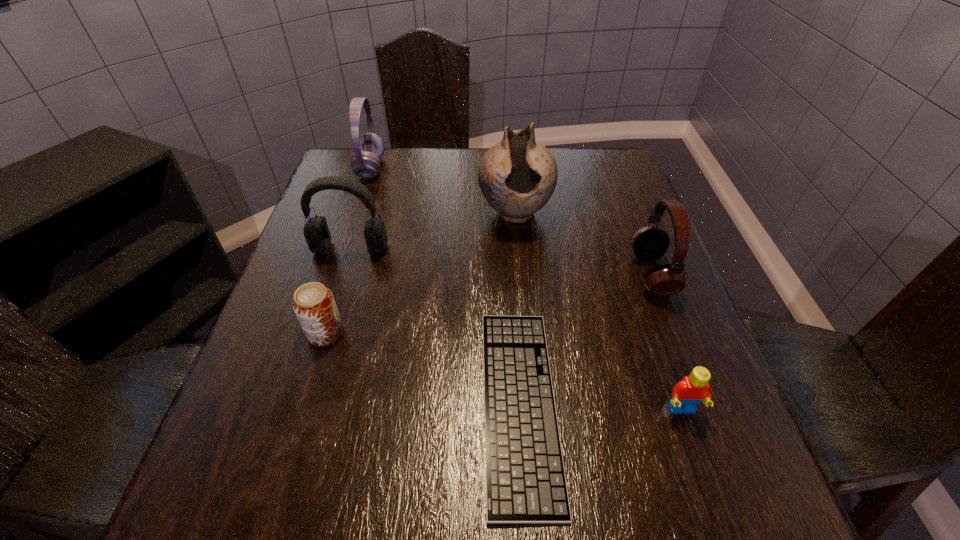
Locate an element on the screen. This screenshot has width=960, height=540. vacant space located 0.070m on the ear pads of the rightmost headset is located at coordinates (602, 274).

Where is `vacant point located on the back of the beer can`? vacant point located on the back of the beer can is located at coordinates (336, 300).

The image size is (960, 540). What are the coordinates of `free space located 0.150m on the face of the Lego` in the screenshot? It's located at (718, 519).

The width and height of the screenshot is (960, 540). In order to click on vacant space located 0.130m on the back of the computer keyboard in this screenshot , I will do `click(511, 273)`.

Identify the location of pottery positioned at the far edge. (517, 176).

At what (x,y) coordinates should I click in order to perform the action: click on headset at the far edge. Please return your answer as a coordinate pair (x, y). The image size is (960, 540). Looking at the image, I should click on (369, 148).

The image size is (960, 540). Find the location of `object located at the near edge`. object located at the near edge is located at coordinates (525, 478).

You are a GUI agent. You are given a task and a screenshot of the screen. Output one action in this format:
    pyautogui.click(x=<x>, y=<y>)
    Task: Click on the beer can that is at the left edge
    
    Given the screenshot: What is the action you would take?
    pyautogui.click(x=314, y=305)

The height and width of the screenshot is (540, 960). I want to click on headset located at the right edge, so click(649, 243).

Image resolution: width=960 pixels, height=540 pixels. Find the location of `Lego that is at the right edge`. Lego that is at the right edge is located at coordinates (691, 390).